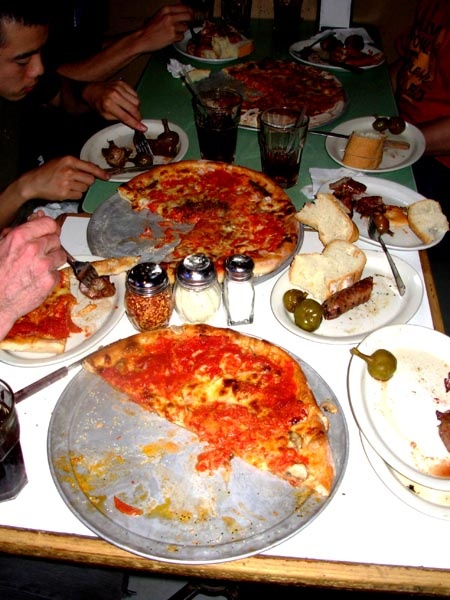
Locate an element on the screen. fork is located at coordinates (86, 275), (140, 144).